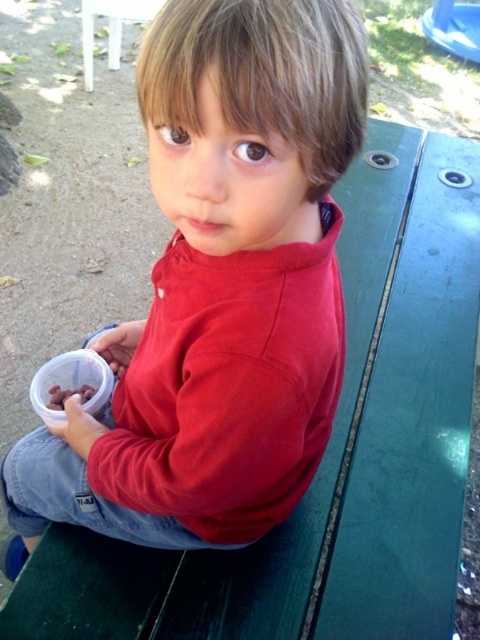
Looking at this image, you are a photographer trying to capture the child in the center wearing a red sweatshirt. The child is holding a small plastic container in their left hand. You want to place a focus point on the red sweatshirt to ensure the child is in focus. The focus point is at point (218,289). Is this focus point on the red sweatshirt?

Yes, the focus point at point (218,289) is on the matte red sweatshirt at center, so placing the focus point there will ensure the child is in focus.

You are a photographer trying to capture the child in the scene. You want to ensure that both the matte red sweatshirt at center and the brown matte nuts at lower left are clearly visible in the photo. Based on their positions, which object should you focus on first to ensure both are in focus?

The matte red sweatshirt at center is in front of the brown matte nuts at lower left. To ensure both are in focus, you should focus on the matte red sweatshirt at center first since it is closer to the camera, and the nuts will be in the background but still within the depth of field.

You are a photographer standing 20 inches away from the camera. You want to take a photo of the matte red sweatshirt at center. Can you reach it without moving closer than your current position?

The matte red sweatshirt at center is 15.90 inches away from the camera, which is within the photographer standing at 20 inches. Therefore, the photographer can reach it without moving closer.